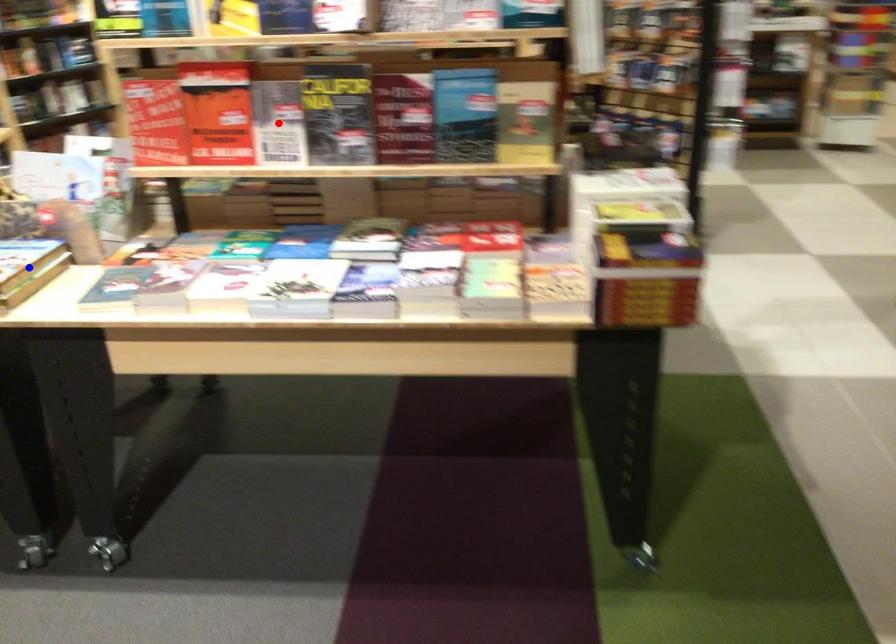
Question: Which of the two points in the image is closer to the camera?

Choices:
 (A) Blue point is closer.
 (B) Red point is closer.

Answer: (A)